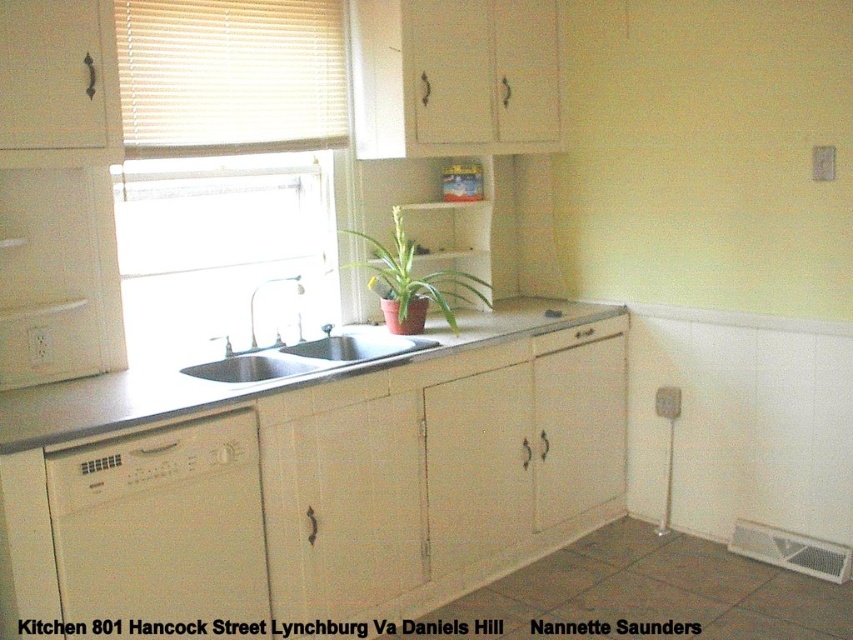
Describe the element at coordinates (230, 76) in the screenshot. This screenshot has width=853, height=640. I see `white blinds at upper center` at that location.

At what (x,y) coordinates should I click in order to perform the action: click on white blinds at upper center. Please return your answer as a coordinate pair (x, y). This screenshot has height=640, width=853. Looking at the image, I should click on (230, 76).

Who is taller, white matte dishwasher at lower left or white matte drawer at center?

white matte dishwasher at lower left

This screenshot has width=853, height=640. In order to click on white matte dishwasher at lower left in this screenshot , I will do `click(161, 529)`.

Does matte clay pot at center have a lesser width compared to white matte drawer at center?

No, matte clay pot at center is not thinner than white matte drawer at center.

Consider the image. Is matte clay pot at center above white matte drawer at center?

Correct, matte clay pot at center is located above white matte drawer at center.

Which is behind, point (474, 289) or point (610, 330)?

The point (474, 289) is behind.

The height and width of the screenshot is (640, 853). In order to click on matte clay pot at center in this screenshot , I will do `click(412, 282)`.